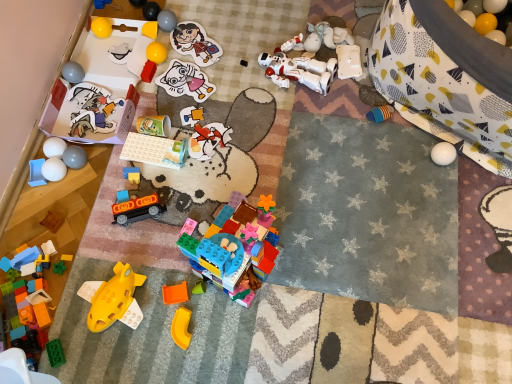
Identify the location of vacant area that lies to the right of matte gray ball at left, placed as the seventeenth toy when sorted from right to left. (124, 164).